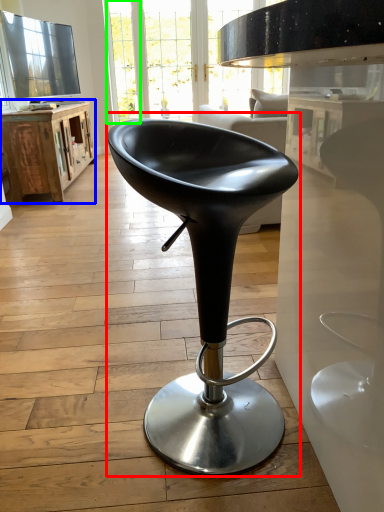
Question: Which is nearer to the chair (highlighted by a red box)? table (highlighted by a blue box) or glass door (highlighted by a green box).

Choices:
 (A) table
 (B) glass door

Answer: (A)